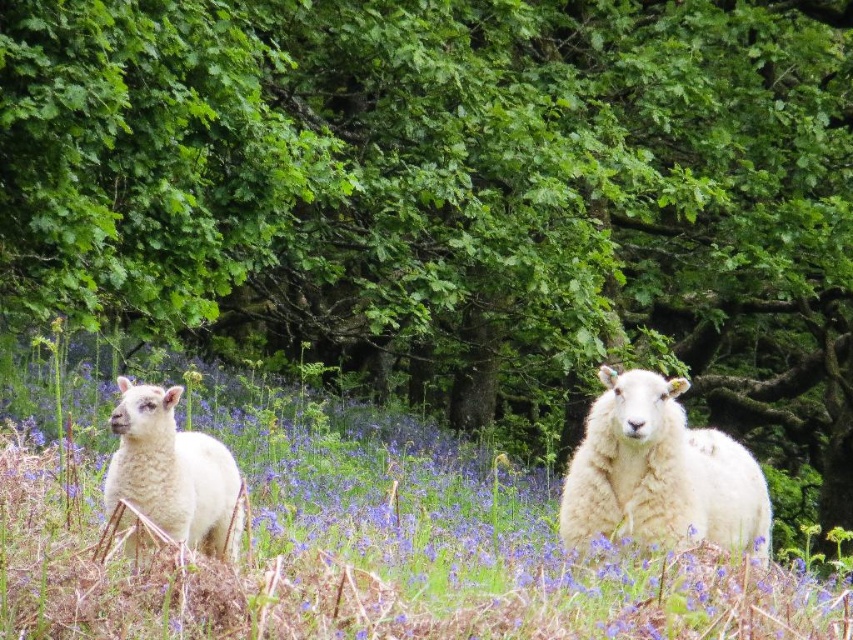
Does white fluffy grass at center come behind white woolly lamb at left?

No.

Is white fluffy grass at center smaller than white woolly lamb at left?

Indeed, white fluffy grass at center has a smaller size compared to white woolly lamb at left.

Who is more distant from viewer, (297, 573) or (149, 481)?

The point (149, 481) is behind.

I want to click on white fluffy grass at center, so click(344, 534).

Is point (335, 449) in front of point (721, 452)?

No, (335, 449) is behind (721, 452).

Image resolution: width=853 pixels, height=640 pixels. I want to click on white fluffy grass at center, so click(344, 534).

This screenshot has height=640, width=853. I want to click on white fluffy grass at center, so click(344, 534).

Does white woolly sheep at center come behind white woolly lamb at left?

Yes, it is behind white woolly lamb at left.

The width and height of the screenshot is (853, 640). I want to click on white woolly sheep at center, so click(x=659, y=474).

The width and height of the screenshot is (853, 640). In order to click on white woolly sheep at center in this screenshot , I will do `click(659, 474)`.